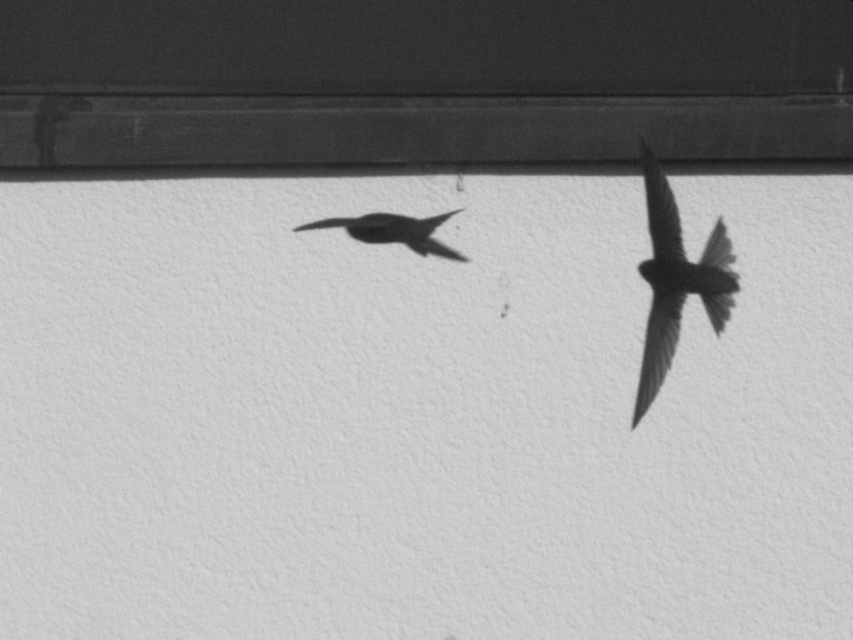
Question: Which point is closer to the camera?

Choices:
 (A) smooth black bird at center
 (B) silvery metallic bird at right

Answer: (A)

Question: Is silvery metallic bird at right to the left of smooth black bird at center from the viewer's perspective?

Choices:
 (A) no
 (B) yes

Answer: (A)

Question: Which point is farther to the camera?

Choices:
 (A) silvery metallic bird at right
 (B) smooth black bird at center

Answer: (A)

Question: Does silvery metallic bird at right have a greater width compared to smooth black bird at center?

Choices:
 (A) yes
 (B) no

Answer: (B)

Question: Which point is farther from the camera taking this photo?

Choices:
 (A) (647, 195)
 (B) (450, 248)

Answer: (A)

Question: Does silvery metallic bird at right have a greater width compared to smooth black bird at center?

Choices:
 (A) no
 (B) yes

Answer: (A)